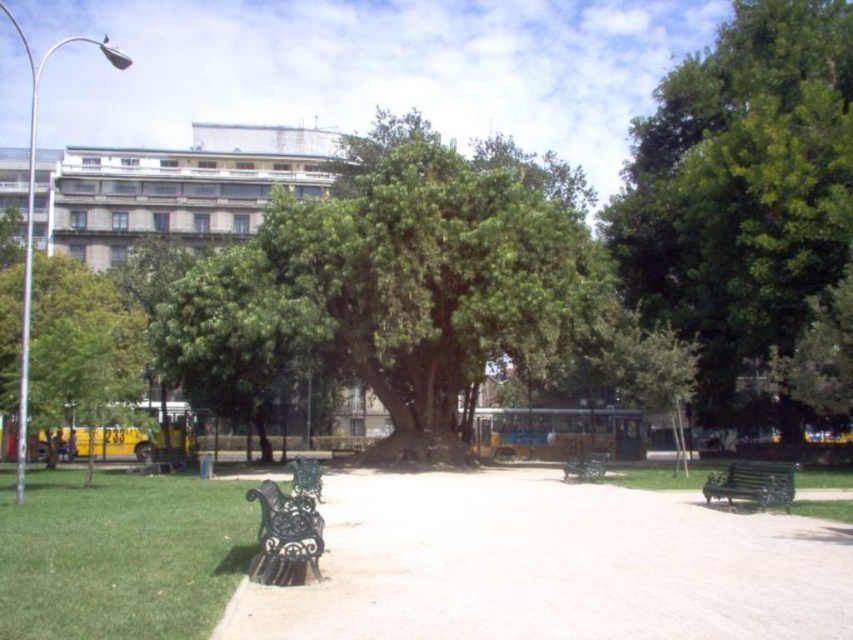
You are planning to take a photo of the green leafy tree at left and the green wrought iron bench at lower right. Which object should you focus on first if you want to capture both in the same frame without moving the camera?

The green leafy tree at left has a lesser width compared to the green wrought iron bench at lower right, so you should focus on the green leafy tree at left first to ensure both fit in the frame.